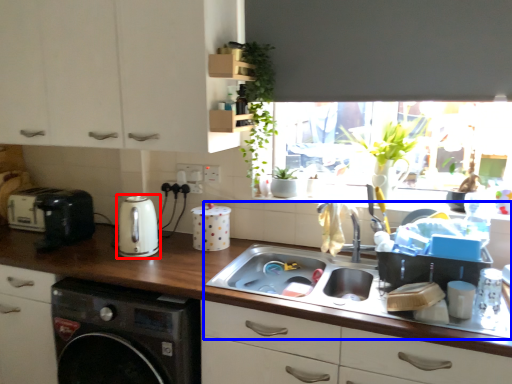
Question: Which point is further to the camera, kitchen appliance (highlighted by a red box) or sink (highlighted by a blue box)?

Choices:
 (A) kitchen appliance
 (B) sink

Answer: (A)